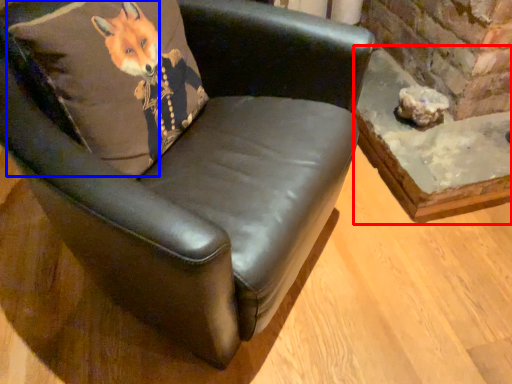
Question: Which object is closer to the camera taking this photo, table (highlighted by a red box) or pillow (highlighted by a blue box)?

Choices:
 (A) table
 (B) pillow

Answer: (B)